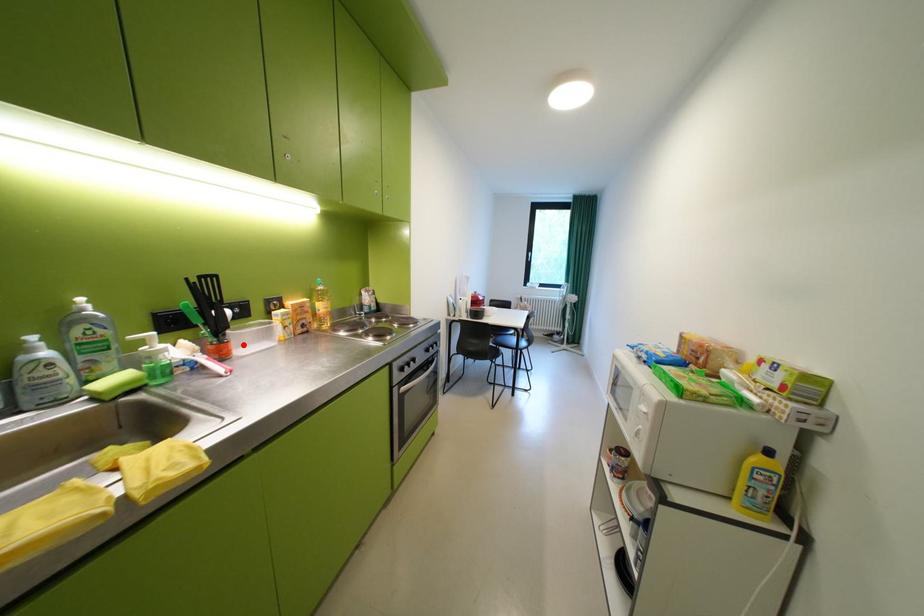
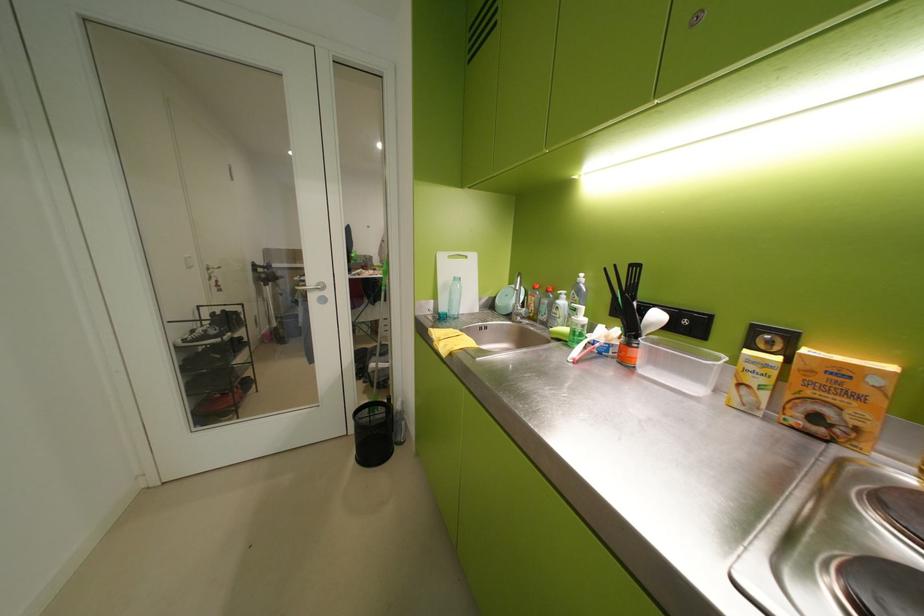
Where in the second image is the point corresponding to the highlighted location from the first image?

(650, 354)